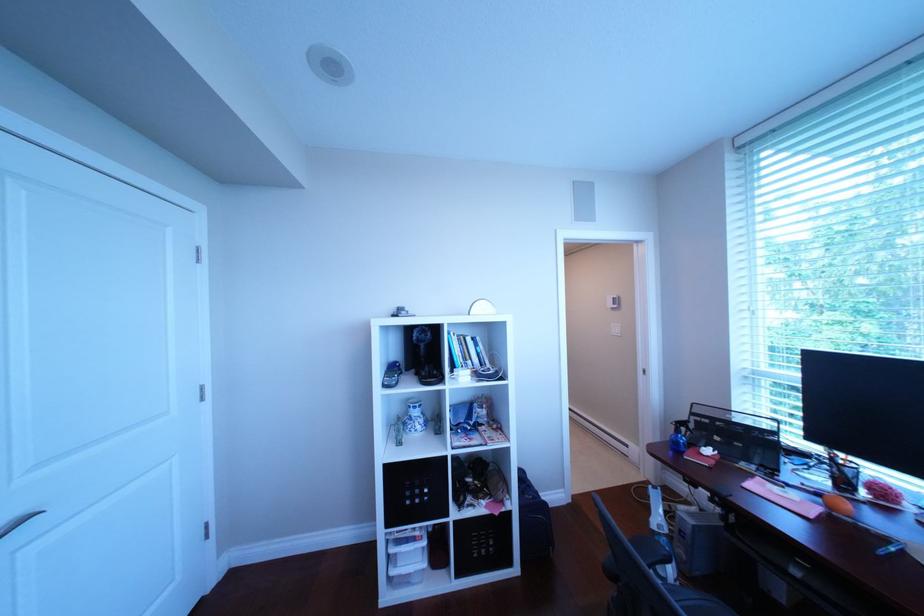
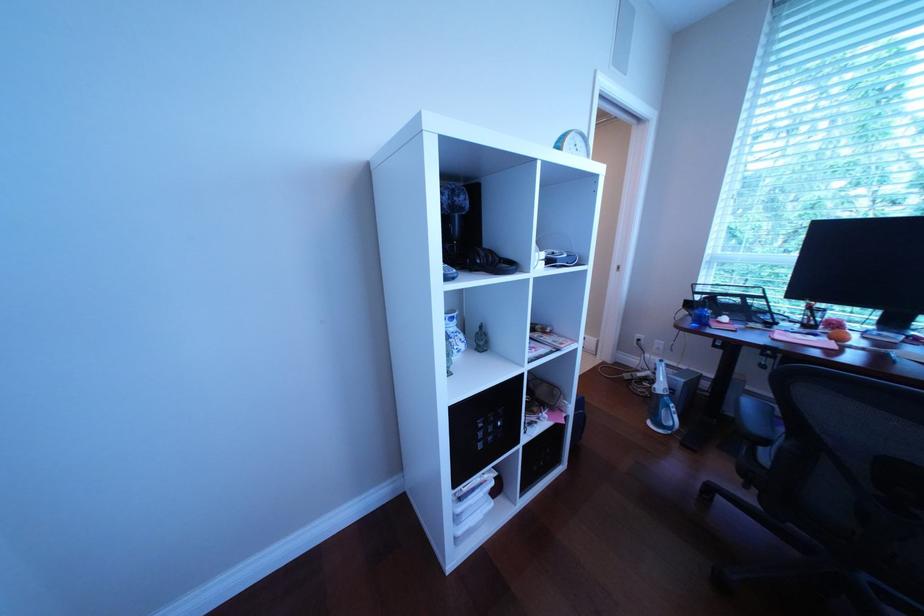
How did the camera likely rotate?

The rotation direction of the camera is right-down.